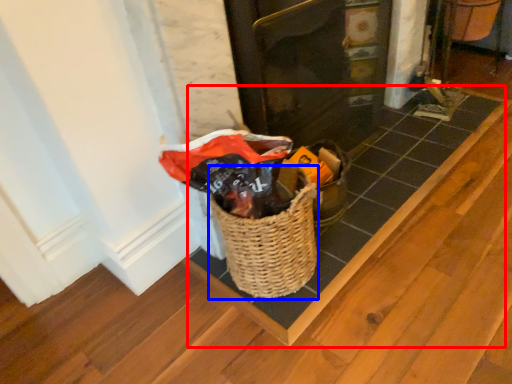
Question: Which point is closer to the camera, plank (highlighted by a red box) or basket (highlighted by a blue box)?

Choices:
 (A) plank
 (B) basket

Answer: (B)